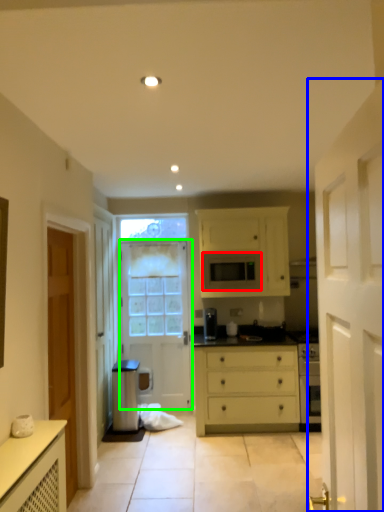
Question: Which is farther away from microwave oven (highlighted by a red box)? door (highlighted by a blue box) or door (highlighted by a green box)?

Choices:
 (A) door
 (B) door

Answer: (A)